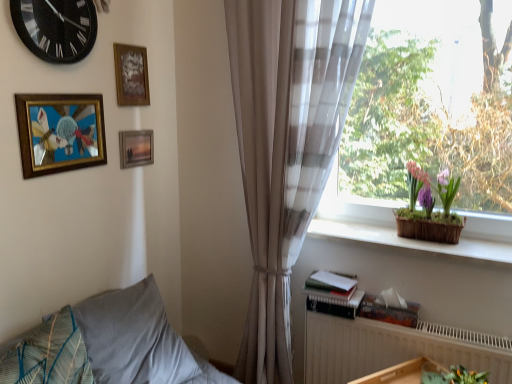
Image resolution: width=512 pixels, height=384 pixels. What are the coordinates of `wooden frame at upper center, positioned as the 1th picture frame in back-to-front order` in the screenshot? It's located at pyautogui.click(x=136, y=148).

The height and width of the screenshot is (384, 512). What do you see at coordinates (429, 208) in the screenshot?
I see `matte brown pot at window` at bounding box center [429, 208].

Locate an element on the screen. This screenshot has height=384, width=512. textured blue pillow at lower left, which is the 1th pillow in front-to-back order is located at coordinates (47, 354).

Identify the location of wooden frame at upper center, placed as the 3th picture frame when sorted from front to back. (136, 148).

Which of these two, gray fabric pillow at lower left, which ranks as the 1th pillow in back-to-front order, or wooden basket at right, stands shorter?

With less height is wooden basket at right.

From a real-world perspective, is gray fabric pillow at lower left, which ranks as the 1th pillow in back-to-front order, beneath wooden basket at right?

Yes, from a real-world perspective, gray fabric pillow at lower left, which ranks as the 1th pillow in back-to-front order, is under wooden basket at right.

Considering the sizes of objects gray fabric pillow at lower left, which ranks as the 2th pillow in front-to-back order, and wooden basket at right in the image provided, who is wider, gray fabric pillow at lower left, which ranks as the 2th pillow in front-to-back order, or wooden basket at right?

With larger width is gray fabric pillow at lower left, which ranks as the 2th pillow in front-to-back order.

Where is `the 2nd pillow directly beneath the wooden basket at right (from a real-world perspective)`? the 2nd pillow directly beneath the wooden basket at right (from a real-world perspective) is located at coordinates (133, 337).

Is matte brown pot at window not close to translucent fabric at right?

That's not correct — matte brown pot at window is a little close to translucent fabric at right.

Is matte brown pot at window at the left side of translucent fabric at right?

No, matte brown pot at window is not to the left of translucent fabric at right.

Which of these two, matte brown pot at window or translucent fabric at right, is thinner?

matte brown pot at window.

Is matte brown pot at window in front of or behind translucent fabric at right in the image?

Clearly, matte brown pot at window is behind translucent fabric at right.

Can you tell me how much wooden basket at right and matte brown pot at window differ in facing direction?

The angular difference between wooden basket at right and matte brown pot at window is 0.000153 degrees.

In order to click on window sill that is below the matte brown pot at window (from the image's perspective) in this screenshot , I will do `click(411, 240)`.

Is wooden basket at right inside or outside of matte brown pot at window?

wooden basket at right is outside matte brown pot at window.

Would you say textured blue pillow at lower left, the 2th pillow in the back-to-front sequence, is to the left or to the right of white textured radiator at lower right in the picture?

Based on their positions, textured blue pillow at lower left, the 2th pillow in the back-to-front sequence, is located to the left of white textured radiator at lower right.

Where is `the 2nd pillow in front when counting from the white textured radiator at lower right`? The width and height of the screenshot is (512, 384). the 2nd pillow in front when counting from the white textured radiator at lower right is located at coordinates (47, 354).

Considering the relative sizes of textured blue pillow at lower left, which is the 1th pillow in front-to-back order, and white textured radiator at lower right in the image provided, is textured blue pillow at lower left, which is the 1th pillow in front-to-back order, bigger than white textured radiator at lower right?

Incorrect, textured blue pillow at lower left, which is the 1th pillow in front-to-back order, is not larger than white textured radiator at lower right.

From a real-world perspective, is textured blue pillow at lower left, which is the 1th pillow in front-to-back order, physically located above or below white textured radiator at lower right?

From a real-world perspective, textured blue pillow at lower left, which is the 1th pillow in front-to-back order, is physically above white textured radiator at lower right.

How many degrees apart are the facing directions of sheer beige curtain at right and translucent fabric at right?

The angular difference between sheer beige curtain at right and translucent fabric at right is 5.24e-05 degrees.

From a real-world perspective, is sheer beige curtain at right on translucent fabric at right?

No, from a real-world perspective, sheer beige curtain at right is not on top of translucent fabric at right.

Is sheer beige curtain at right facing towards translucent fabric at right?

No, sheer beige curtain at right is not oriented towards translucent fabric at right.

Looking at the image, does sheer beige curtain at right seem bigger or smaller compared to translucent fabric at right?

In the image, sheer beige curtain at right appears to be larger than translucent fabric at right.

Considering the points (148, 159) and (132, 97), which point is in front, point (148, 159) or point (132, 97)?

Point (132, 97)

Is wooden frame at upper center, positioned as the 1th picture frame in back-to-front order, oriented away from wooden frame at upper center, acting as the second picture frame starting from the front?

No, wooden frame at upper center, acting as the second picture frame starting from the front, is not at the back of wooden frame at upper center, positioned as the 1th picture frame in back-to-front order.

Between wooden frame at upper center, positioned as the 1th picture frame in back-to-front order, and wooden frame at upper center, acting as the second picture frame starting from the front, which one has smaller size?

wooden frame at upper center, positioned as the 1th picture frame in back-to-front order.

Between wooden frame at upper center, placed as the 3th picture frame when sorted from front to back, and wooden frame at upper center, acting as the second picture frame starting from the back, which one has less height?

Answer: With less height is wooden frame at upper center, placed as the 3th picture frame when sorted from front to back.

Which object is closer to the camera taking this photo, wooden basket at right or translucent fabric at right?

translucent fabric at right.

From the image's perspective, is wooden basket at right above or below translucent fabric at right?

From the image's perspective, wooden basket at right appears below translucent fabric at right.

From a real-world perspective, is wooden basket at right beneath translucent fabric at right?

Yes.

Is wooden basket at right wider or thinner than translucent fabric at right?

In the image, wooden basket at right appears to be more narrow than translucent fabric at right.

Identify the location of the 1st pillow in front when counting from the wooden basket at right. This screenshot has width=512, height=384. (133, 337).

What are the coordinates of `window above the matte brown pot at window (from a real-world perspective)` in the screenshot? It's located at (440, 48).

In the scene shown: From the image, which object appears to be nearer to wooden frame at upper center, placed as the 3th picture frame when sorted from front to back, sheer beige curtain at right or gold-framed artwork at upper left, positioned as the first picture frame in front-to-back order?

Among the two, gold-framed artwork at upper left, positioned as the first picture frame in front-to-back order, is located nearer to wooden frame at upper center, placed as the 3th picture frame when sorted from front to back.

When comparing their distances from wooden frame at upper center, acting as the second picture frame starting from the front, does wooden frame at upper center, positioned as the 1th picture frame in back-to-front order, or textured blue pillow at lower left, which is the 1th pillow in front-to-back order, seem further?

textured blue pillow at lower left, which is the 1th pillow in front-to-back order.

Looking at the image, which one is located closer to wooden frame at upper center, acting as the second picture frame starting from the back, black glass clock at upper left or textured blue pillow at lower left, which is the 1th pillow in front-to-back order?

Based on the image, black glass clock at upper left appears to be nearer to wooden frame at upper center, acting as the second picture frame starting from the back.

Which object lies nearer to the anchor point sheer beige curtain at right, wooden frame at upper center, positioned as the 1th picture frame in back-to-front order, or black glass clock at upper left?

wooden frame at upper center, positioned as the 1th picture frame in back-to-front order, is closer to sheer beige curtain at right.

Which object lies further to the anchor point matte brown pot at window, wooden frame at upper center, placed as the 3th picture frame when sorted from front to back, or wooden basket at right?

Based on the image, wooden frame at upper center, placed as the 3th picture frame when sorted from front to back, appears to be further to matte brown pot at window.

When comparing their distances from wooden basket at right, does black glass clock at upper left or matte brown pot at window seem closer?

matte brown pot at window is positioned closer to the anchor wooden basket at right.

From the picture: From the image, which object appears to be farther from sheer beige curtain at right, wooden basket at right or gray fabric pillow at lower left, which ranks as the 1th pillow in back-to-front order?

gray fabric pillow at lower left, which ranks as the 1th pillow in back-to-front order, lies further to sheer beige curtain at right than the other object.

Looking at the image, which one is located further to translucent fabric at right, sheer beige curtain at right or wooden basket at right?

sheer beige curtain at right is further to translucent fabric at right.

Where is `picture frame located between wooden frame at upper center, placed as the 3th picture frame when sorted from front to back, and matte brown pot at window in the left-right direction`? The height and width of the screenshot is (384, 512). picture frame located between wooden frame at upper center, placed as the 3th picture frame when sorted from front to back, and matte brown pot at window in the left-right direction is located at coordinates (131, 75).

Locate an element on the screen. radiator between wooden frame at upper center, acting as the second picture frame starting from the back, and matte brown pot at window is located at coordinates (394, 348).

Identify the location of picture frame between gold-framed artwork at upper left, which is the third picture frame in back-to-front order, and gray fabric pillow at lower left, which ranks as the 2th pillow in front-to-back order, in the vertical direction. (136, 148).

The width and height of the screenshot is (512, 384). In order to click on curtain located between wooden frame at upper center, acting as the second picture frame starting from the front, and translucent fabric at right in the left-right direction in this screenshot , I will do `click(286, 146)`.